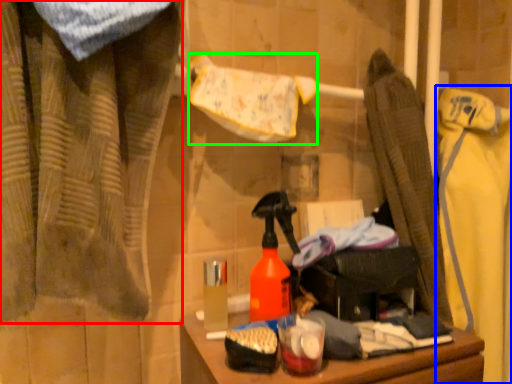
Question: Which is farther away from curtain (highlighted by a red box)? clothing (highlighted by a blue box) or bath towel (highlighted by a green box)?

Choices:
 (A) clothing
 (B) bath towel

Answer: (A)